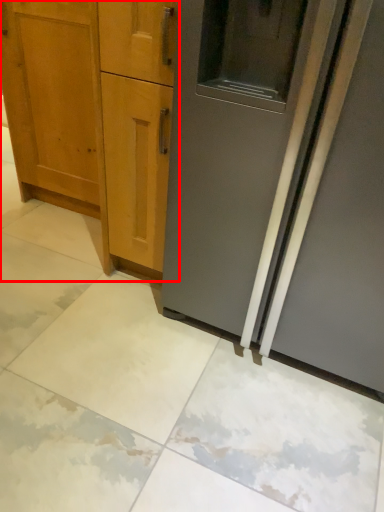
Question: In this image, where is cabinetry (annotated by the red box) located relative to door?

Choices:
 (A) left
 (B) right

Answer: (A)